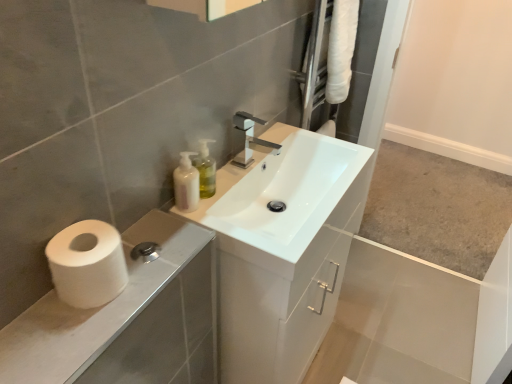
Question: From the image's perspective, is white glossy sink at center above or below white matte toilet paper at lower left?

Choices:
 (A) below
 (B) above

Answer: (B)

Question: Is white glossy sink at center in front of or behind white matte toilet paper at lower left in the image?

Choices:
 (A) front
 (B) behind

Answer: (B)

Question: Which is farther from the translucent plastic soap dispenser at upper center?

Choices:
 (A) white matte toilet paper at lower left
 (B) white matte pump bottle at upper center
 (C) white glossy cabinet at lower left
 (D) white glossy sink at center

Answer: (A)

Question: Which object is the farthest from the white matte toilet paper at lower left?

Choices:
 (A) white glossy sink at center
 (B) white glossy cabinet at lower left
 (C) white matte pump bottle at upper center
 (D) translucent plastic soap dispenser at upper center

Answer: (A)